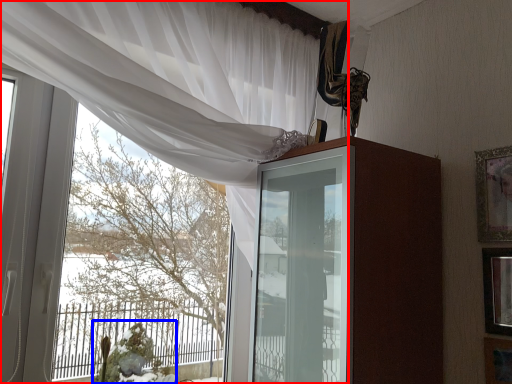
Question: Which object appears farthest to the camera in this image, curtain (highlighted by a red box) or floral arrangement (highlighted by a blue box)?

Choices:
 (A) curtain
 (B) floral arrangement

Answer: (B)